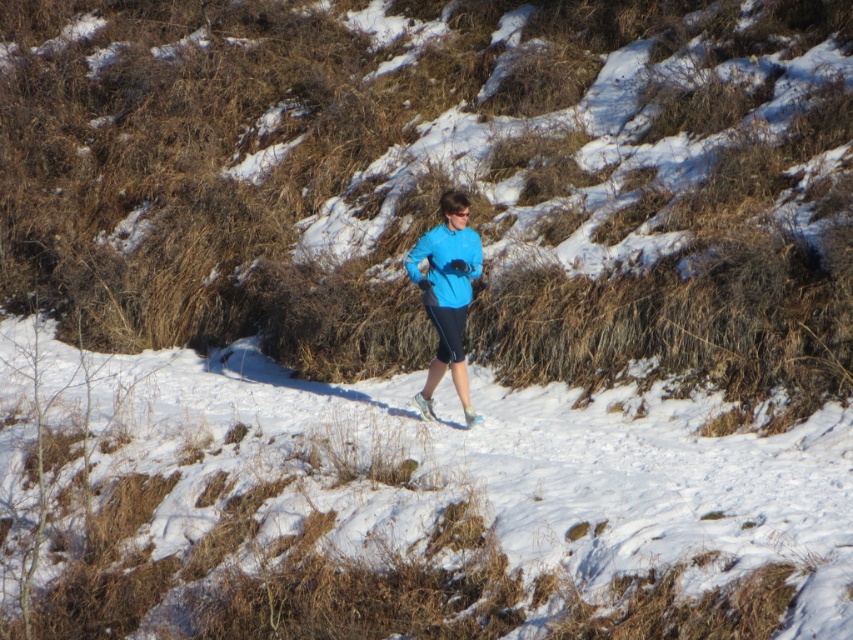
Question: Which of the following is the closest to the observer?

Choices:
 (A) white powdery snow at center
 (B) blue matte sweatshirt at center
 (C) blue matte jacket at center

Answer: (A)

Question: Is white powdery snow at center to the left of blue matte sweatshirt at center from the viewer's perspective?

Choices:
 (A) no
 (B) yes

Answer: (B)

Question: Estimate the real-world distances between objects in this image. Which object is closer to the blue matte jacket at center?

Choices:
 (A) white powdery snow at center
 (B) blue matte sweatshirt at center

Answer: (B)

Question: Is white powdery snow at center bigger than blue matte sweatshirt at center?

Choices:
 (A) yes
 (B) no

Answer: (A)

Question: Which object is farther from the camera taking this photo?

Choices:
 (A) blue matte jacket at center
 (B) blue matte sweatshirt at center

Answer: (B)

Question: Is white powdery snow at center smaller than blue matte sweatshirt at center?

Choices:
 (A) yes
 (B) no

Answer: (B)